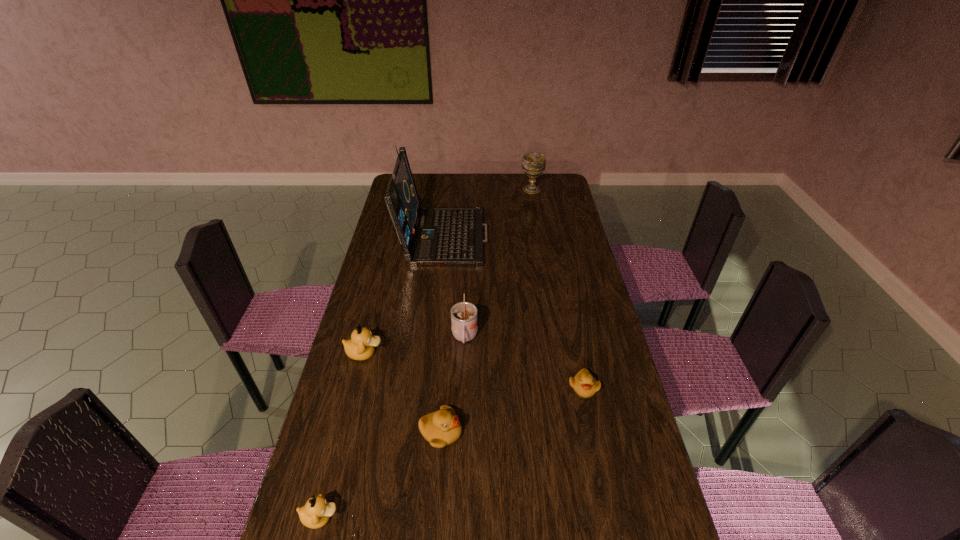
Locate an element on the screen. The image size is (960, 540). free space that satisfies the following two spatial constraints: 1. on the front side of the white chalice; 2. on the face of the smaller tan duckling is located at coordinates (588, 517).

This screenshot has width=960, height=540. Find the location of `vacant space that satisfies the following two spatial constraints: 1. on the front-facing side of the second farthest duckling; 2. on the face of the nearest object`. vacant space that satisfies the following two spatial constraints: 1. on the front-facing side of the second farthest duckling; 2. on the face of the nearest object is located at coordinates (611, 517).

The width and height of the screenshot is (960, 540). I want to click on free space that satisfies the following two spatial constraints: 1. on the front side of the farthest object; 2. on the face of the fourth shortest object, so 561,353.